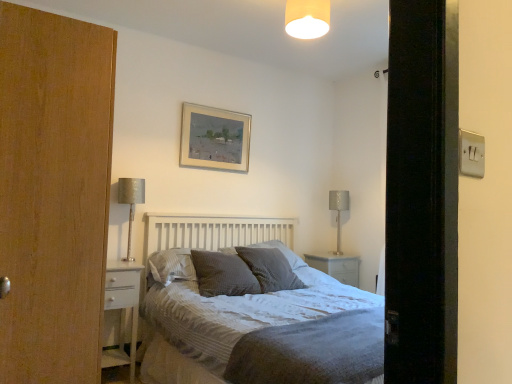
Question: Is dark grey textured pillow at center, arranged as the 1th pillow when viewed from the left, at the right side of white glossy nightstand at lower left?

Choices:
 (A) no
 (B) yes

Answer: (B)

Question: Is white glossy nightstand at lower left at the back of dark grey textured pillow at center, which is counted as the 4th pillow, starting from the right?

Choices:
 (A) yes
 (B) no

Answer: (B)

Question: Considering the relative sizes of dark grey textured pillow at center, which is counted as the 4th pillow, starting from the right, and white glossy nightstand at lower left in the image provided, is dark grey textured pillow at center, which is counted as the 4th pillow, starting from the right, wider than white glossy nightstand at lower left?

Choices:
 (A) no
 (B) yes

Answer: (A)

Question: Considering the relative sizes of dark grey textured pillow at center, which is counted as the 4th pillow, starting from the right, and white glossy nightstand at lower left in the image provided, is dark grey textured pillow at center, which is counted as the 4th pillow, starting from the right, smaller than white glossy nightstand at lower left?

Choices:
 (A) yes
 (B) no

Answer: (A)

Question: Is dark grey textured pillow at center, arranged as the 1th pillow when viewed from the left, positioned beyond the bounds of white glossy nightstand at lower left?

Choices:
 (A) yes
 (B) no

Answer: (A)

Question: Would you say satin silver table lamp at right, acting as the first table lamp starting from the right, is inside or outside textured grey pillow at center, which is counted as the third pillow, starting from the left?

Choices:
 (A) outside
 (B) inside

Answer: (A)

Question: From a real-world perspective, is satin silver table lamp at right, marked as the 1th table lamp in a back-to-front arrangement, positioned above or below textured grey pillow at center, which is the second pillow from right to left?

Choices:
 (A) below
 (B) above

Answer: (B)

Question: Is point (343, 208) positioned closer to the camera than point (224, 251)?

Choices:
 (A) closer
 (B) farther

Answer: (B)

Question: Based on their positions, is satin silver table lamp at right, acting as the first table lamp starting from the right, located to the left or right of textured grey pillow at center, which is counted as the third pillow, starting from the left?

Choices:
 (A) left
 (B) right

Answer: (B)

Question: From a real-world perspective, relative to matte beige lampshade at upper center, is dark grey textured pillow at center, arranged as the 1th pillow when viewed from the left, vertically above or below?

Choices:
 (A) below
 (B) above

Answer: (A)

Question: In terms of width, does dark grey textured pillow at center, arranged as the 1th pillow when viewed from the left, look wider or thinner when compared to matte beige lampshade at upper center?

Choices:
 (A) thin
 (B) wide

Answer: (B)

Question: Considering the positions of dark grey textured pillow at center, which is counted as the 4th pillow, starting from the right, and matte beige lampshade at upper center in the image, is dark grey textured pillow at center, which is counted as the 4th pillow, starting from the right, taller or shorter than matte beige lampshade at upper center?

Choices:
 (A) tall
 (B) short

Answer: (B)

Question: From the image's perspective, is dark grey textured pillow at center, arranged as the 1th pillow when viewed from the left, above or below matte beige lampshade at upper center?

Choices:
 (A) below
 (B) above

Answer: (A)

Question: Is dark grey textured pillow at center, which is counted as the 4th pillow, starting from the right, in front of or behind textured gray pillow at center, the 1th pillow when ordered from right to left, in the image?

Choices:
 (A) behind
 (B) front

Answer: (B)

Question: From the image's perspective, relative to textured gray pillow at center, arranged as the 4th pillow when viewed from the left, is dark grey textured pillow at center, which is counted as the 4th pillow, starting from the right, above or below?

Choices:
 (A) above
 (B) below

Answer: (A)